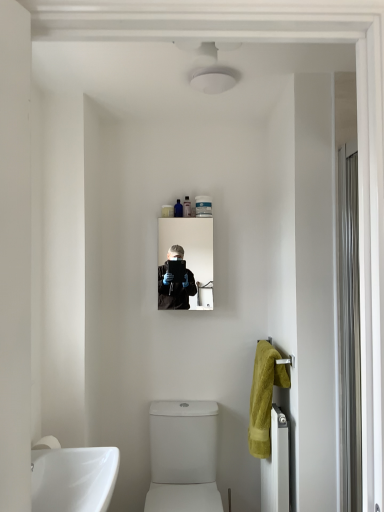
Locate an element on the screen. clear glass mirror at center is located at coordinates (189, 243).

The image size is (384, 512). Describe the element at coordinates (187, 207) in the screenshot. I see `translucent plastic tube at upper center, the second toiletry viewed from the left` at that location.

Find the location of a particular element. clear glass screen door at right is located at coordinates (349, 333).

Locate an element on the screen. Image resolution: width=384 pixels, height=512 pixels. soft yellow towel at right is located at coordinates (264, 397).

Is translucent plastic tube at upper center, the second toiletry viewed from the left, oriented away from white metallic radiator at lower right?

translucent plastic tube at upper center, the second toiletry viewed from the left, does not have its back to white metallic radiator at lower right.

From a real-world perspective, is translucent plastic tube at upper center, the second toiletry viewed from the left, located higher than white metallic radiator at lower right?

Yes.

Locate an element on the screen. The height and width of the screenshot is (512, 384). radiator lying in front of the translucent plastic tube at upper center, the second toiletry viewed from the left is located at coordinates (276, 466).

Between translucent plastic tube at upper center, the second toiletry viewed from the left, and white metallic radiator at lower right, which one appears on the right side from the viewer's perspective?

From the viewer's perspective, white metallic radiator at lower right appears more on the right side.

Is point (189, 234) farther from camera compared to point (187, 198)?

No, (189, 234) is closer to viewer.

Between clear glass mirror at center and translucent plastic tube at upper center, which is counted as the second toiletry, starting from the right, which one is positioned behind?

translucent plastic tube at upper center, which is counted as the second toiletry, starting from the right, is further away from the camera.

Which object is wider, clear glass mirror at center or translucent plastic tube at upper center, the second toiletry viewed from the left?

clear glass mirror at center.

Considering the sizes of translucent plastic container at upper center, which ranks as the 1th toiletry in left-to-right order, and clear glass screen door at right in the image, is translucent plastic container at upper center, which ranks as the 1th toiletry in left-to-right order, taller or shorter than clear glass screen door at right?

Clearly, translucent plastic container at upper center, which ranks as the 1th toiletry in left-to-right order, is shorter compared to clear glass screen door at right.

How far apart are translucent plastic container at upper center, which ranks as the 1th toiletry in left-to-right order, and clear glass screen door at right?

translucent plastic container at upper center, which ranks as the 1th toiletry in left-to-right order, and clear glass screen door at right are 1.13 meters apart from each other.

Which object is further away from the camera, translucent plastic container at upper center, which appears as the 3th toiletry when viewed from the right, or clear glass screen door at right?

translucent plastic container at upper center, which appears as the 3th toiletry when viewed from the right, is behind.

Considering the relative sizes of translucent plastic container at upper center, which ranks as the 1th toiletry in left-to-right order, and clear glass screen door at right in the image provided, is translucent plastic container at upper center, which ranks as the 1th toiletry in left-to-right order, wider than clear glass screen door at right?

In fact, translucent plastic container at upper center, which ranks as the 1th toiletry in left-to-right order, might be narrower than clear glass screen door at right.

From the picture: Does white glossy toilet at lower center appear on the right side of clear glass mirror at center?

No, white glossy toilet at lower center is not to the right of clear glass mirror at center.

From the image's perspective, is white glossy toilet at lower center positioned above or below clear glass mirror at center?

From the image's perspective, white glossy toilet at lower center appears below clear glass mirror at center.

Is white glossy toilet at lower center oriented towards clear glass mirror at center?

No.

Considering the sizes of objects white glossy toilet at lower center and clear glass mirror at center in the image provided, who is smaller, white glossy toilet at lower center or clear glass mirror at center?

clear glass mirror at center is smaller.

Considering the relative positions of translucent plastic tube at upper center, the second toiletry viewed from the left, and clear glass screen door at right in the image provided, is translucent plastic tube at upper center, the second toiletry viewed from the left, to the left of clear glass screen door at right from the viewer's perspective?

Indeed, translucent plastic tube at upper center, the second toiletry viewed from the left, is positioned on the left side of clear glass screen door at right.

Is point (185, 212) more distant than point (351, 272)?

Yes, point (185, 212) is farther from viewer.

From the picture: Does translucent plastic tube at upper center, which is counted as the second toiletry, starting from the right, turn towards clear glass screen door at right?

No, translucent plastic tube at upper center, which is counted as the second toiletry, starting from the right, is not oriented towards clear glass screen door at right.

Measure the distance between clear glass screen door at right and translucent plastic tube at upper center, which is counted as the second toiletry, starting from the right.

clear glass screen door at right and translucent plastic tube at upper center, which is counted as the second toiletry, starting from the right, are 1.06 meters apart.

This screenshot has width=384, height=512. Identify the location of screen door on the right of translucent plastic tube at upper center, which is counted as the second toiletry, starting from the right. (349, 333).

Considering the positions of objects clear glass screen door at right and translucent plastic tube at upper center, the second toiletry viewed from the left, in the image provided, who is more to the left, clear glass screen door at right or translucent plastic tube at upper center, the second toiletry viewed from the left,?

translucent plastic tube at upper center, the second toiletry viewed from the left, is more to the left.

Is clear glass screen door at right with translucent plastic tube at upper center, the second toiletry viewed from the left?

They are not placed beside each other.

Is white metallic radiator at lower right positioned far away from soft yellow towel at right?

No, white metallic radiator at lower right is not far from soft yellow towel at right.

From a real-world perspective, is white metallic radiator at lower right above or below soft yellow towel at right?

white metallic radiator at lower right is below soft yellow towel at right.

Relative to soft yellow towel at right, is white metallic radiator at lower right in front or behind?

Visually, white metallic radiator at lower right is located in front of soft yellow towel at right.

Measure the distance from white metallic radiator at lower right to soft yellow towel at right.

They are 4.05 inches apart.

Image resolution: width=384 pixels, height=512 pixels. Find the location of `toiletry that is the 3rd one when counting upward from the white metallic radiator at lower right (from the image's perspective)`. toiletry that is the 3rd one when counting upward from the white metallic radiator at lower right (from the image's perspective) is located at coordinates (187, 207).

Where is `toiletry that is the 3rd object above the clear glass mirror at center (from a real-world perspective)`? This screenshot has height=512, width=384. toiletry that is the 3rd object above the clear glass mirror at center (from a real-world perspective) is located at coordinates (187, 207).

Which object lies nearer to the anchor point clear glass mirror at center, clear glass screen door at right or translucent plastic container at upper center, which appears as the 3th toiletry when viewed from the right?

translucent plastic container at upper center, which appears as the 3th toiletry when viewed from the right.

Considering their positions, is white metallic radiator at lower right positioned closer to white matte tube at upper center, placed as the third toiletry when sorted from left to right, than clear glass mirror at center?

clear glass mirror at center lies closer to white matte tube at upper center, placed as the third toiletry when sorted from left to right, than the other object.

Based on their spatial positions, is translucent plastic tube at upper center, which is counted as the second toiletry, starting from the right, or white glossy toilet at lower center closer to white metallic radiator at lower right?

white glossy toilet at lower center is closer to white metallic radiator at lower right.

When comparing their distances from white glossy toilet at lower center, does translucent plastic container at upper center, which ranks as the 1th toiletry in left-to-right order, or white matte tube at upper center, arranged as the 1th toiletry when viewed from the right, seem closer?

white matte tube at upper center, arranged as the 1th toiletry when viewed from the right, lies closer to white glossy toilet at lower center than the other object.

When comparing their distances from white glossy toilet at lower center, does translucent plastic container at upper center, which appears as the 3th toiletry when viewed from the right, or white metallic radiator at lower right seem further?

translucent plastic container at upper center, which appears as the 3th toiletry when viewed from the right, is positioned further to the anchor white glossy toilet at lower center.

When comparing their distances from soft yellow towel at right, does white metallic radiator at lower right or translucent plastic container at upper center, which appears as the 3th toiletry when viewed from the right, seem closer?

white metallic radiator at lower right is positioned closer to the anchor soft yellow towel at right.

Looking at the image, which one is located closer to white metallic radiator at lower right, white glossy toilet at lower center or white matte tube at upper center, placed as the third toiletry when sorted from left to right?

Based on the image, white glossy toilet at lower center appears to be nearer to white metallic radiator at lower right.

When comparing their distances from translucent plastic container at upper center, which ranks as the 1th toiletry in left-to-right order, does translucent plastic tube at upper center, which is counted as the second toiletry, starting from the right, or clear glass mirror at center seem further?

clear glass mirror at center is positioned further to the anchor translucent plastic container at upper center, which ranks as the 1th toiletry in left-to-right order.

Identify the location of mirror that lies between translucent plastic container at upper center, which appears as the 3th toiletry when viewed from the right, and white glossy toilet at lower center from top to bottom. The width and height of the screenshot is (384, 512). (189, 243).

Where is `radiator between clear glass mirror at center and white glossy toilet at lower center in the vertical direction`? radiator between clear glass mirror at center and white glossy toilet at lower center in the vertical direction is located at coordinates (276, 466).

Where is `toiletry that lies between white matte tube at upper center, arranged as the 1th toiletry when viewed from the right, and white metallic radiator at lower right from top to bottom`? toiletry that lies between white matte tube at upper center, arranged as the 1th toiletry when viewed from the right, and white metallic radiator at lower right from top to bottom is located at coordinates (167, 211).

In order to click on toiletry between white matte tube at upper center, arranged as the 1th toiletry when viewed from the right, and white glossy toilet at lower center vertically in this screenshot , I will do `click(167, 211)`.